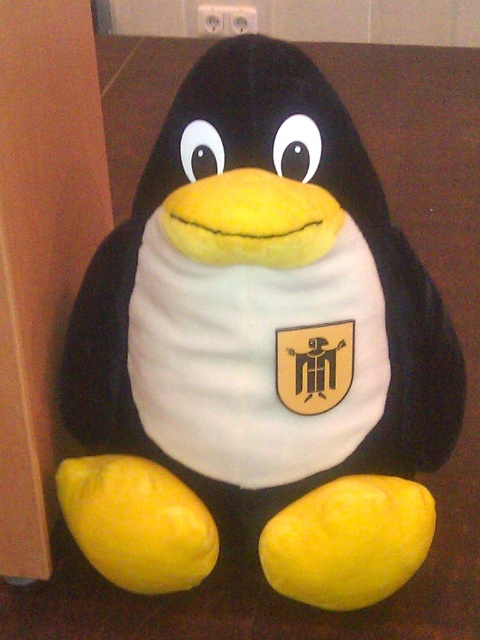
Question: In this image, where is yellow matte lemon at lower center located relative to yellow matte lemon at lower left?

Choices:
 (A) left
 (B) right

Answer: (B)

Question: Can you confirm if yellow matte lemon at lower center is positioned to the left of yellow matte lemon at lower left?

Choices:
 (A) yes
 (B) no

Answer: (B)

Question: Does yellow matte lemon at lower center have a lesser width compared to yellow matte lemon at lower left?

Choices:
 (A) yes
 (B) no

Answer: (B)

Question: Which point appears closest to the camera in this image?

Choices:
 (A) (93, 506)
 (B) (424, 499)

Answer: (A)

Question: Which of the following is the farthest from the observer?

Choices:
 (A) (176, 477)
 (B) (325, 547)

Answer: (A)